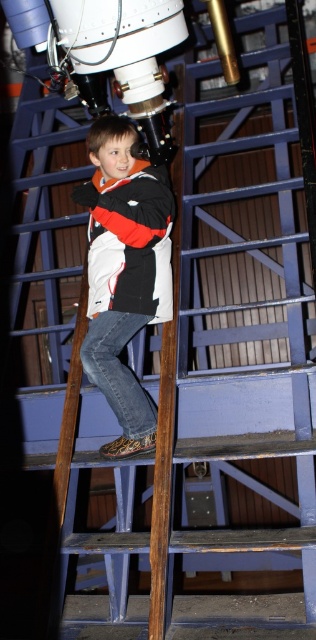
Is denim jacket at center behind white matte jacket at center?

No.

Consider the image. Who is shorter, denim jacket at center or white matte jacket at center?

white matte jacket at center is shorter.

The height and width of the screenshot is (640, 316). Find the location of `denim jacket at center`. denim jacket at center is located at coordinates (125, 273).

Locate an element on the screen. denim jacket at center is located at coordinates (125, 273).